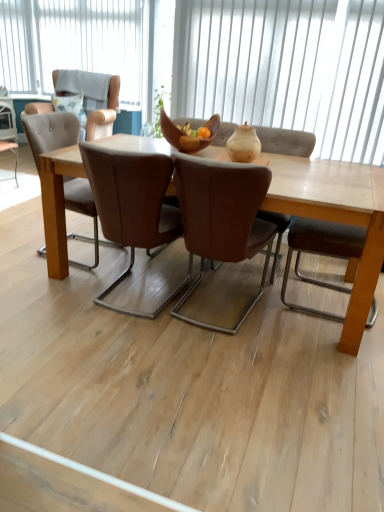
Question: In terms of width, does brown leather chair at center, which is the 2th chair in left-to-right order, look wider or thinner when compared to white vertical blinds at upper center, which is the 1th window from bottom to top?

Choices:
 (A) thin
 (B) wide

Answer: (B)

Question: From a real-world perspective, relative to white vertical blinds at upper center, which appears as the 1th window when viewed from the front, is brown leather chair at center, which is the 2th chair in left-to-right order, vertically above or below?

Choices:
 (A) above
 (B) below

Answer: (B)

Question: Based on their relative distances, which object is farther from the light brown wooden table at center?

Choices:
 (A) wooden bowl at center
 (B) brown leather chair at center, which is the 2th chair in left-to-right order
 (C) white vertical blinds at upper center, which appears as the first window when viewed from the right
 (D) white vertical blinds at upper center, placed as the second window when sorted from right to left
 (E) light brown leather armchair at upper left

Answer: (D)

Question: Estimate the real-world distances between objects in this image. Which object is farther from the brown leather chair at center, which is counted as the 1th chair, starting from the right?

Choices:
 (A) wooden bowl at center
 (B) matte beige vase at center
 (C) light brown leather armchair at upper left
 (D) light brown wooden table at center
 (E) brown leather chair at center, the 2th chair positioned from the right

Answer: (C)